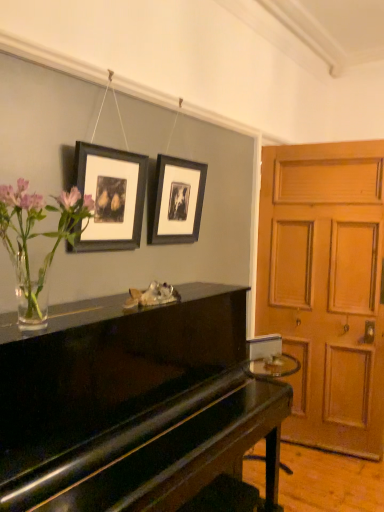
I want to click on glossy black piano at center, so click(x=132, y=404).

The width and height of the screenshot is (384, 512). I want to click on clear glass vase with flowers at left, so click(x=36, y=237).

What do you see at coordinates (177, 201) in the screenshot?
I see `black matte picture frame at upper center, the 2th picture frame when ordered from front to back` at bounding box center [177, 201].

Where is `wooden door at right`? wooden door at right is located at coordinates (326, 288).

Where is `glossy black piano at center`? Image resolution: width=384 pixels, height=512 pixels. glossy black piano at center is located at coordinates (132, 404).

Which is closer, (x=34, y=212) or (x=256, y=418)?

Clearly, point (x=34, y=212) is closer to the camera than point (x=256, y=418).

From a real-world perspective, which object stands above the other?

clear glass vase with flowers at left, from a real-world perspective.

From the image's perspective, relative to glossy black piano at center, is clear glass vase with flowers at left above or below?

clear glass vase with flowers at left is above glossy black piano at center.

Locate an element on the screen. The height and width of the screenshot is (512, 384). piano in front of the clear glass vase with flowers at left is located at coordinates (132, 404).

How different are the orientations of glossy black piano at center and clear glass vase with flowers at left in degrees?

The angular difference between glossy black piano at center and clear glass vase with flowers at left is 0.65 degrees.

Which object is closer to the camera taking this photo, glossy black piano at center or clear glass vase with flowers at left?

glossy black piano at center is closer to the camera.

Based on the photo, from a real-world perspective, who is located lower, glossy black piano at center or clear glass vase with flowers at left?

glossy black piano at center, from a real-world perspective.

Is glossy black piano at center at the left side of clear glass vase with flowers at left?

No.

From the image's perspective, is black matte picture frame at upper center, the first picture frame in the back-to-front sequence, above or below glossy black piano at center?

From the image's perspective, black matte picture frame at upper center, the first picture frame in the back-to-front sequence, appears above glossy black piano at center.

Can you confirm if black matte picture frame at upper center, which appears as the 2th picture frame when viewed from the left, is smaller than glossy black piano at center?

Correct, black matte picture frame at upper center, which appears as the 2th picture frame when viewed from the left, occupies less space than glossy black piano at center.

From a real-world perspective, which is physically below, black matte picture frame at upper center, arranged as the 1th picture frame when viewed from the right, or glossy black piano at center?

glossy black piano at center, from a real-world perspective.

Could you tell me if glossy black piano at center is facing wooden door at right?

No, glossy black piano at center is not facing towards wooden door at right.

Looking at this image, is glossy black piano at center further to camera compared to wooden door at right?

No.

Does glossy black piano at center have a larger size compared to wooden door at right?

Yes.

Measure the distance between glossy black piano at center and wooden door at right.

A distance of 3.68 feet exists between glossy black piano at center and wooden door at right.

Does wooden door at right have a smaller size compared to black matte picture frame at upper center, arranged as the 1th picture frame when viewed from the right?

Actually, wooden door at right might be larger than black matte picture frame at upper center, arranged as the 1th picture frame when viewed from the right.

Is wooden door at right taller or shorter than black matte picture frame at upper center, the 2th picture frame when ordered from front to back?

Clearly, wooden door at right is taller compared to black matte picture frame at upper center, the 2th picture frame when ordered from front to back.

From the image's perspective, relative to black matte picture frame at upper center, the 2th picture frame when ordered from front to back, is wooden door at right above or below?

From the image's perspective, wooden door at right appears below black matte picture frame at upper center, the 2th picture frame when ordered from front to back.

In the scene shown: Would you consider wooden door at right to be distant from black matte picture frame at upper center, arranged as the 1th picture frame when viewed from the right?

That's right, there is a large distance between wooden door at right and black matte picture frame at upper center, arranged as the 1th picture frame when viewed from the right.

You are a GUI agent. You are given a task and a screenshot of the screen. Output one action in this format:
    pyautogui.click(x=<x>, y=<y>)
    Task: Click on the door lying on the right of clear glass vase with flowers at left
    
    Given the screenshot: What is the action you would take?
    326,288

From a real-world perspective, which object stands above the other?

clear glass vase with flowers at left, from a real-world perspective.

Are clear glass vase with flowers at left and wooden door at right making contact?

No, clear glass vase with flowers at left is not making contact with wooden door at right.

Is matte black picture frame at upper center, the 1th picture frame viewed from the left, taller or shorter than glossy black piano at center?

Considering their sizes, matte black picture frame at upper center, the 1th picture frame viewed from the left, has less height than glossy black piano at center.

Is matte black picture frame at upper center, positioned as the second picture frame in right-to-left order, facing towards glossy black piano at center?

No, matte black picture frame at upper center, positioned as the second picture frame in right-to-left order, does not turn towards glossy black piano at center.

Which of these two, matte black picture frame at upper center, positioned as the 2th picture frame in back-to-front order, or glossy black piano at center, is wider?

With larger width is glossy black piano at center.

Is matte black picture frame at upper center, the 1th picture frame viewed from the left, positioned before glossy black piano at center?

No, it is not.

The width and height of the screenshot is (384, 512). In order to click on piano located below the clear glass vase with flowers at left (from the image's perspective) in this screenshot , I will do `click(132, 404)`.

Identify the location of floral arrangement above the glossy black piano at center (from a real-world perspective). The height and width of the screenshot is (512, 384). (36, 237).

From the image, which object appears to be nearer to clear glass vase with flowers at left, glossy black piano at center or black matte picture frame at upper center, arranged as the 1th picture frame when viewed from the right?

glossy black piano at center is closer to clear glass vase with flowers at left.

From the image, which object appears to be nearer to glossy black piano at center, matte black picture frame at upper center, positioned as the 2th picture frame in back-to-front order, or wooden door at right?

The object closer to glossy black piano at center is matte black picture frame at upper center, positioned as the 2th picture frame in back-to-front order.

Estimate the real-world distances between objects in this image. Which object is further from matte black picture frame at upper center, the 1th picture frame viewed from the left, black matte picture frame at upper center, arranged as the 1th picture frame when viewed from the right, or wooden door at right?

Based on the image, wooden door at right appears to be further to matte black picture frame at upper center, the 1th picture frame viewed from the left.

From the image, which object appears to be nearer to matte black picture frame at upper center, positioned as the second picture frame in right-to-left order, glossy black piano at center or black matte picture frame at upper center, the first picture frame in the back-to-front sequence?

black matte picture frame at upper center, the first picture frame in the back-to-front sequence, is positioned closer to the anchor matte black picture frame at upper center, positioned as the second picture frame in right-to-left order.

Consider the image. When comparing their distances from glossy black piano at center, does matte black picture frame at upper center, positioned as the second picture frame in right-to-left order, or clear glass vase with flowers at left seem closer?

Among the two, clear glass vase with flowers at left is located nearer to glossy black piano at center.

Estimate the real-world distances between objects in this image. Which object is further from clear glass vase with flowers at left, glossy black piano at center or matte black picture frame at upper center, the 1th picture frame viewed from the left?

glossy black piano at center is positioned further to the anchor clear glass vase with flowers at left.

Consider the image. Considering their positions, is clear glass vase with flowers at left positioned further to black matte picture frame at upper center, which appears as the 2th picture frame when viewed from the left, than matte black picture frame at upper center, the 1th picture frame viewed from the left?

Based on the image, clear glass vase with flowers at left appears to be further to black matte picture frame at upper center, which appears as the 2th picture frame when viewed from the left.

Looking at this image, considering their positions, is glossy black piano at center positioned closer to wooden door at right than matte black picture frame at upper center, the 1th picture frame viewed from the left?

glossy black piano at center.

At what (x,y) coordinates should I click in order to perform the action: click on picture frame located between clear glass vase with flowers at left and black matte picture frame at upper center, which appears as the 2th picture frame when viewed from the left, in the depth direction. Please return your answer as a coordinate pair (x, y). Image resolution: width=384 pixels, height=512 pixels. Looking at the image, I should click on (110, 197).

You are a GUI agent. You are given a task and a screenshot of the screen. Output one action in this format:
    pyautogui.click(x=<x>, y=<y>)
    Task: Click on the floral arrangement between matte black picture frame at upper center, positioned as the 2th picture frame in back-to-front order, and glossy black piano at center vertically
    
    Given the screenshot: What is the action you would take?
    pyautogui.click(x=36, y=237)

Where is `picture frame between matte black picture frame at upper center, the 1th picture frame viewed from the left, and wooden door at right from left to right`? picture frame between matte black picture frame at upper center, the 1th picture frame viewed from the left, and wooden door at right from left to right is located at coordinates (177, 201).

Where is `picture frame that lies between black matte picture frame at upper center, the first picture frame in the back-to-front sequence, and glossy black piano at center from top to bottom`? picture frame that lies between black matte picture frame at upper center, the first picture frame in the back-to-front sequence, and glossy black piano at center from top to bottom is located at coordinates (110, 197).